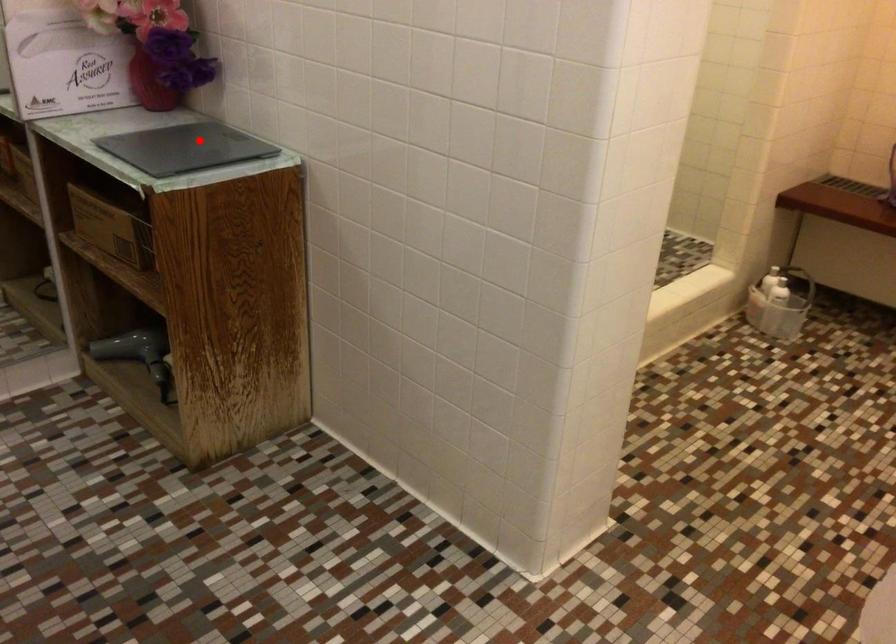
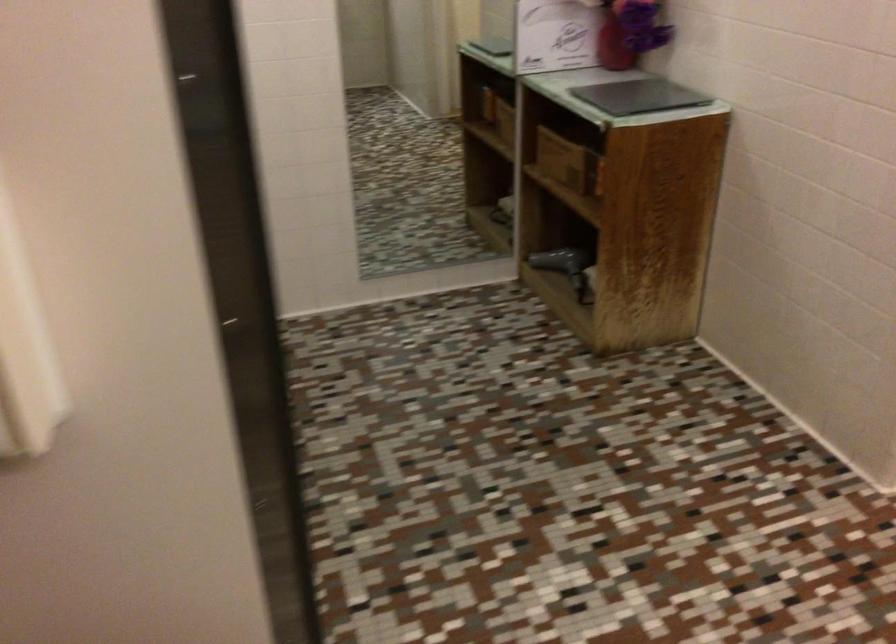
The point at the highlighted location is marked in the first image. Where is the corresponding point in the second image?

(639, 96)